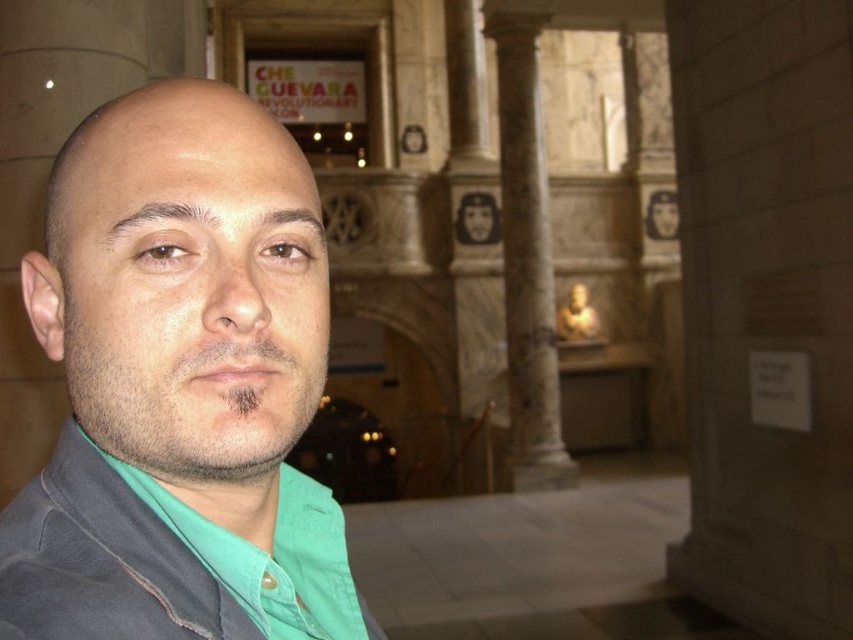
You are a fashion designer observing two jackets in an image. The first is a gray matte jacket at left, and the second is a dark gray matte jacket at center. Which jacket appears taller in the image?

The gray matte jacket at left appears taller than the dark gray matte jacket at center.

You are a tour guide leading a group through the Che Guevara museum. A visitor asks if they can walk from the gray matte jacket at left to the marble column at center. Given that the average walking distance for a person is about 10 meters, can they comfortably make this journey without needing to stop?

The gray matte jacket at left and marble column at center are 13.17 meters apart from each other. Since the average walking distance is about 10 meters, the visitor would need to walk an extra 3.17 meters beyond their comfort range, so they might need to take a short break before reaching the marble column at center.

You are standing in the Che Guevara museum and see the marble column at center and the dark gray matte jacket at center. Which object is positioned to the right of the other?

The marble column at center is to the right of the dark gray matte jacket at center.